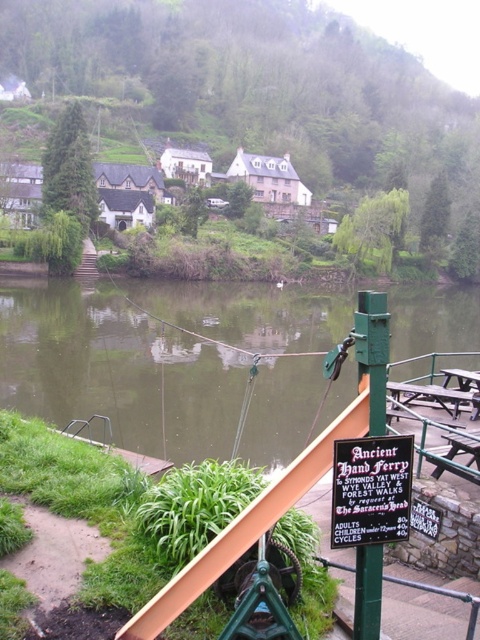
How much distance is there between green smooth water at center and wooden picnic table at center?

green smooth water at center and wooden picnic table at center are 91.64 feet apart.

Between green smooth water at center and wooden picnic table at center, which one has less height?

wooden picnic table at center is shorter.

The image size is (480, 640). I want to click on green smooth water at center, so click(153, 355).

Between black plastic sign at center-right and green painted metal pole at lower right, which one is positioned higher?

green painted metal pole at lower right is above.

Which of these two, black plastic sign at center-right or green painted metal pole at lower right, stands shorter?

black plastic sign at center-right

From the picture: Measure the distance between black plastic sign at center-right and camera.

They are 3.78 meters apart.

Where is `black plastic sign at center-right`? black plastic sign at center-right is located at coordinates (371, 490).

Can you confirm if black plastic sign at center-right is positioned above wooden picnic table at center?

Yes, black plastic sign at center-right is above wooden picnic table at center.

Where is `black plastic sign at center-right`? black plastic sign at center-right is located at coordinates (371, 490).

Locate an element on the screen. black plastic sign at center-right is located at coordinates (371, 490).